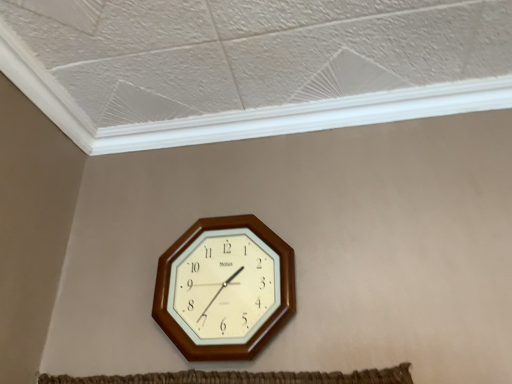
Question: In the image, is wooden wall clock at center positioned in front of or behind white plastic trim at upper center?

Choices:
 (A) front
 (B) behind

Answer: (A)

Question: In terms of height, does wooden wall clock at center look taller or shorter compared to white plastic trim at upper center?

Choices:
 (A) short
 (B) tall

Answer: (B)

Question: From the image's perspective, is wooden wall clock at center above or below white plastic trim at upper center?

Choices:
 (A) above
 (B) below

Answer: (B)

Question: Considering the positions of white plastic trim at upper center and wooden wall clock at center in the image, is white plastic trim at upper center bigger or smaller than wooden wall clock at center?

Choices:
 (A) small
 (B) big

Answer: (A)

Question: Is white plastic trim at upper center to the left or to the right of wooden wall clock at center in the image?

Choices:
 (A) left
 (B) right

Answer: (B)

Question: Is point (108, 127) positioned closer to the camera than point (192, 344)?

Choices:
 (A) closer
 (B) farther

Answer: (B)

Question: Is white plastic trim at upper center in front of or behind wooden wall clock at center in the image?

Choices:
 (A) front
 (B) behind

Answer: (B)